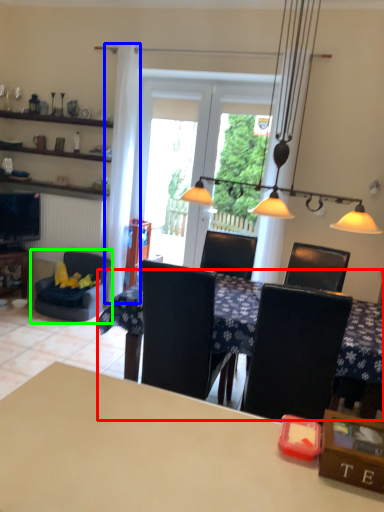
Question: Estimate the real-world distances between objects in this image. Which object is closer to table (highlighted by a red box), curtain (highlighted by a blue box) or chair (highlighted by a green box)?

Choices:
 (A) curtain
 (B) chair

Answer: (B)